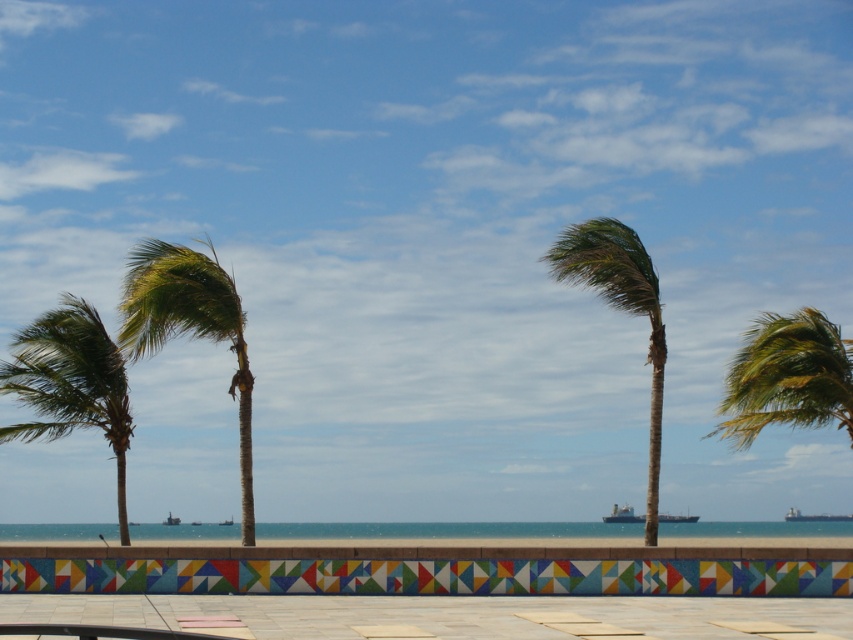
Where is `green leafy palm tree at left`? The width and height of the screenshot is (853, 640). green leafy palm tree at left is located at coordinates (70, 384).

Is green leafy palm tree at left closer to camera compared to green leafy palm tree at right?

Yes, it is.

Between point (44, 387) and point (805, 401), which one is positioned behind?

Point (805, 401)

Find the location of a particular element. green leafy palm tree at left is located at coordinates (70, 384).

Is green leafy palm at left shorter than metallic gray ship at lower left?

In fact, green leafy palm at left may be taller than metallic gray ship at lower left.

This screenshot has width=853, height=640. What are the coordinates of `green leafy palm at left` in the screenshot? It's located at (189, 326).

The width and height of the screenshot is (853, 640). Describe the element at coordinates (189, 326) in the screenshot. I see `green leafy palm at left` at that location.

Where is `green leafy palm at left`? The width and height of the screenshot is (853, 640). green leafy palm at left is located at coordinates (189, 326).

Does point (809, 406) come closer to viewer compared to point (421, 532)?

Yes, it is.

Does point (840, 412) come farther from viewer compared to point (469, 536)?

That is False.

Find the location of a particular element. green leafy palm tree at right is located at coordinates (787, 378).